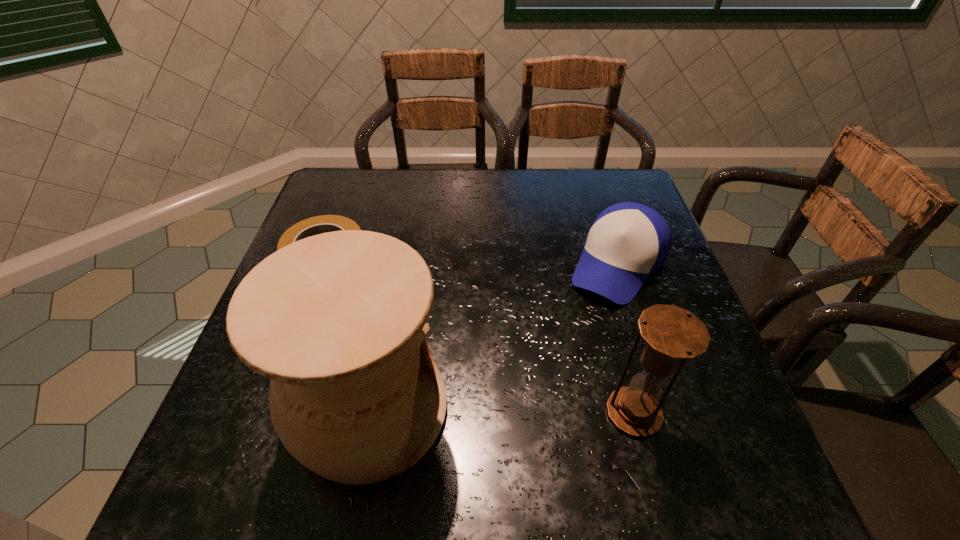
Image resolution: width=960 pixels, height=540 pixels. Identify the location of vacant spot on the desktop that is between the pottery and the second tallest object and is positioned at the edge of the shortest object. (492, 411).

The width and height of the screenshot is (960, 540). I want to click on free space on the desktop that is between the pottery and the third shortest object and is positioned on the front-facing side of the second shortest object, so click(513, 411).